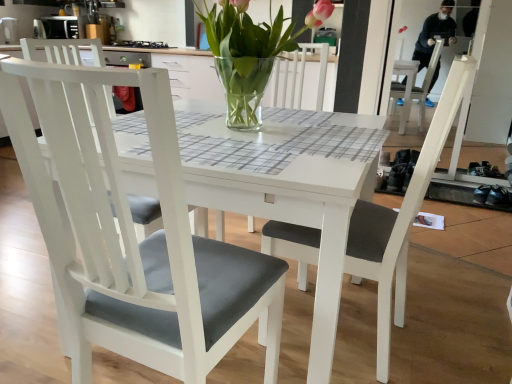
Question: Could clear glass vase at center be considered to be inside white matte chair at left, the second chair when ordered from right to left?

Choices:
 (A) yes
 (B) no

Answer: (B)

Question: Considering the relative sizes of white matte chair at left, the second chair when ordered from right to left, and clear glass vase at center in the image provided, is white matte chair at left, the second chair when ordered from right to left, bigger than clear glass vase at center?

Choices:
 (A) no
 (B) yes

Answer: (B)

Question: Would you say white matte chair at left, the second chair when ordered from right to left, is outside clear glass vase at center?

Choices:
 (A) no
 (B) yes

Answer: (B)

Question: From the image's perspective, is white matte chair at left, the second chair when ordered from right to left, located above clear glass vase at center?

Choices:
 (A) yes
 (B) no

Answer: (B)

Question: Is white matte chair at left, which is the 1th chair in left-to-right order, to the right of clear glass vase at center from the viewer's perspective?

Choices:
 (A) no
 (B) yes

Answer: (A)

Question: Considering the relative positions of white matte chair at left, which is the 1th chair in left-to-right order, and clear glass vase at center in the image provided, is white matte chair at left, which is the 1th chair in left-to-right order, to the left of clear glass vase at center from the viewer's perspective?

Choices:
 (A) no
 (B) yes

Answer: (B)

Question: Is matte gray cushioned chair at center, acting as the second chair starting from the left, with white matte chair at left, the second chair when ordered from right to left?

Choices:
 (A) no
 (B) yes

Answer: (A)

Question: Is matte gray cushioned chair at center, acting as the second chair starting from the left, aimed at white matte chair at left, the second chair when ordered from right to left?

Choices:
 (A) yes
 (B) no

Answer: (A)

Question: Can you confirm if matte gray cushioned chair at center, acting as the second chair starting from the left, is taller than white matte chair at left, which is the 1th chair in left-to-right order?

Choices:
 (A) no
 (B) yes

Answer: (B)

Question: Is matte gray cushioned chair at center, acting as the second chair starting from the left, looking in the opposite direction of white matte chair at left, the second chair when ordered from right to left?

Choices:
 (A) yes
 (B) no

Answer: (A)

Question: From a real-world perspective, does matte gray cushioned chair at center, acting as the second chair starting from the left, sit lower than white matte chair at left, which is the 1th chair in left-to-right order?

Choices:
 (A) no
 (B) yes

Answer: (A)

Question: Does matte gray cushioned chair at center, acting as the second chair starting from the left, have a lesser width compared to white matte chair at left, which is the 1th chair in left-to-right order?

Choices:
 (A) yes
 (B) no

Answer: (A)

Question: Considering the relative sizes of clear glass vase at center and matte gray cushioned chair at center, arranged as the first chair when viewed from the right, in the image provided, is clear glass vase at center thinner than matte gray cushioned chair at center, arranged as the first chair when viewed from the right,?

Choices:
 (A) no
 (B) yes

Answer: (B)